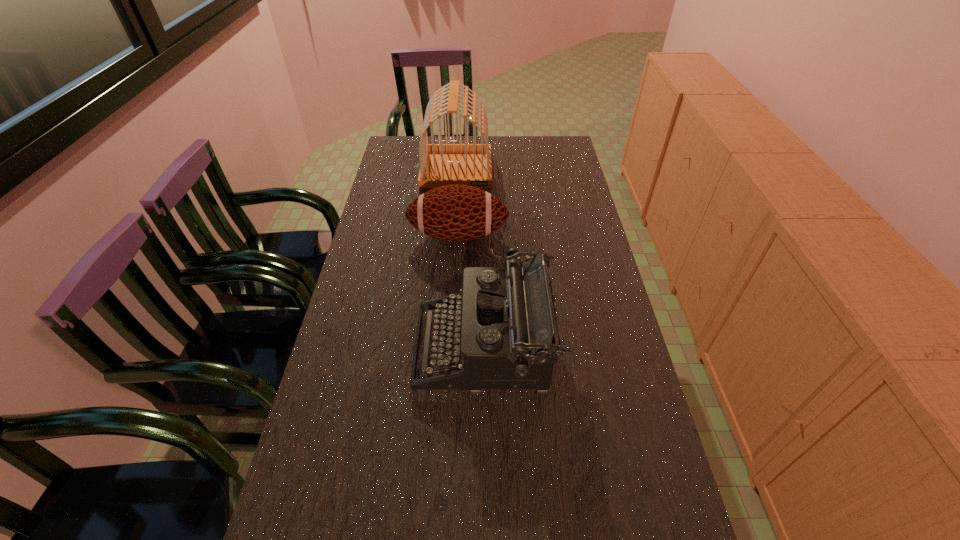
Image resolution: width=960 pixels, height=540 pixels. In order to click on vacant area that lies between the farthest object and the nearest object in this screenshot , I will do `click(470, 259)`.

Locate which object ranks in proximity to the typewriter. Please provide its 2D coordinates. Your answer should be formatted as a tuple, i.e. [(x, y)], where the tuple contains the x and y coordinates of a point satisfying the conditions above.

[(456, 213)]

Identify the location of object that is the second closest to the typewriter. The height and width of the screenshot is (540, 960). (441, 164).

You are a GUI agent. You are given a task and a screenshot of the screen. Output one action in this format:
    pyautogui.click(x=<x>, y=<y>)
    Task: Click on the free point that satisfies the following two spatial constraints: 1. with an open door on the football; 2. on the left side of the tallest object
    
    Given the screenshot: What is the action you would take?
    pyautogui.click(x=452, y=236)

Where is `free region that satisfies the following two spatial constraints: 1. with an open door on the second farthest object; 2. on the left side of the tallest object`? The image size is (960, 540). free region that satisfies the following two spatial constraints: 1. with an open door on the second farthest object; 2. on the left side of the tallest object is located at coordinates (452, 236).